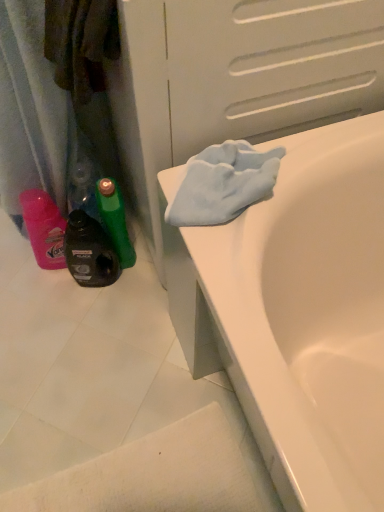
The image size is (384, 512). Describe the element at coordinates (89, 252) in the screenshot. I see `black plastic bottle at lower left` at that location.

I want to click on black plastic bottle at lower left, so click(x=89, y=252).

Identify the location of white glossy bathtub at upper right. (299, 315).

The image size is (384, 512). What do you see at coordinates (299, 315) in the screenshot? I see `white glossy bathtub at upper right` at bounding box center [299, 315].

This screenshot has width=384, height=512. In order to click on black plastic bottle at lower left in this screenshot , I will do `click(89, 252)`.

Is black plastic bottle at lower left at the right side of white glossy bathtub at upper right?

No, black plastic bottle at lower left is not to the right of white glossy bathtub at upper right.

In the image, is black plastic bottle at lower left positioned in front of or behind white glossy bathtub at upper right?

Clearly, black plastic bottle at lower left is behind white glossy bathtub at upper right.

Which is less distant, (x=112, y=278) or (x=377, y=330)?

Point (x=112, y=278) is positioned farther from the camera compared to point (x=377, y=330).

From the image's perspective, would you say black plastic bottle at lower left is shown under white glossy bathtub at upper right?

No, from the image's perspective, black plastic bottle at lower left is not beneath white glossy bathtub at upper right.

From a real-world perspective, who is located lower, black plastic bottle at lower left or white glossy bathtub at upper right?

From a 3D spatial view, black plastic bottle at lower left is below.

In terms of width, does black plastic bottle at lower left look wider or thinner when compared to white glossy bathtub at upper right?

black plastic bottle at lower left is thinner than white glossy bathtub at upper right.

Consider the image. Which of these two, black plastic bottle at lower left or white glossy bathtub at upper right, stands shorter?

black plastic bottle at lower left.

Is black plastic bottle at lower left bigger or smaller than white glossy bathtub at upper right?

Considering their sizes, black plastic bottle at lower left takes up less space than white glossy bathtub at upper right.

Is white glossy bathtub at upper right completely or partially inside black plastic bottle at lower left?

No, white glossy bathtub at upper right is not surrounded by black plastic bottle at lower left.

Is black plastic bottle at lower left far away from white glossy bathtub at upper right?

No, there isn't a large distance between black plastic bottle at lower left and white glossy bathtub at upper right.

Is black plastic bottle at lower left looking in the opposite direction of white glossy bathtub at upper right?

No, black plastic bottle at lower left is not facing the opposite direction of white glossy bathtub at upper right.

This screenshot has height=512, width=384. In the image, there is a black plastic bottle at lower left. What are the coordinates of `bathtub below it (from the image's perspective)` in the screenshot? It's located at (299, 315).

Does white glossy bathtub at upper right appear on the left side of black plastic bottle at lower left?

In fact, white glossy bathtub at upper right is to the right of black plastic bottle at lower left.

Is white glossy bathtub at upper right further to the viewer compared to black plastic bottle at lower left?

No, it is not.

Which is closer, (339, 417) or (73, 252)?

Point (339, 417).

From the image's perspective, between white glossy bathtub at upper right and black plastic bottle at lower left, which one is located above?

black plastic bottle at lower left, from the image's perspective.

From a real-world perspective, is white glossy bathtub at upper right above or below black plastic bottle at lower left?

white glossy bathtub at upper right is situated higher than black plastic bottle at lower left in the real world.

Which of these two, white glossy bathtub at upper right or black plastic bottle at lower left, is thinner?

With smaller width is black plastic bottle at lower left.

Does white glossy bathtub at upper right have a greater height compared to black plastic bottle at lower left?

Yes.

Looking at the image, does white glossy bathtub at upper right seem bigger or smaller compared to black plastic bottle at lower left?

In the image, white glossy bathtub at upper right appears to be larger than black plastic bottle at lower left.

Is white glossy bathtub at upper right not within black plastic bottle at lower left?

Yes, white glossy bathtub at upper right is not within black plastic bottle at lower left.

Are white glossy bathtub at upper right and black plastic bottle at lower left far apart?

No, there isn't a large distance between white glossy bathtub at upper right and black plastic bottle at lower left.

Could you tell me if white glossy bathtub at upper right is facing black plastic bottle at lower left?

No, white glossy bathtub at upper right is not aimed at black plastic bottle at lower left.

How far apart are white glossy bathtub at upper right and black plastic bottle at lower left?

white glossy bathtub at upper right is 20.58 inches away from black plastic bottle at lower left.

I want to click on bottle that is on the left side of white glossy bathtub at upper right, so click(89, 252).

The height and width of the screenshot is (512, 384). Identify the location of bottle below the white glossy bathtub at upper right (from a real-world perspective). (89, 252).

I want to click on bottle located on the left of white glossy bathtub at upper right, so click(x=89, y=252).